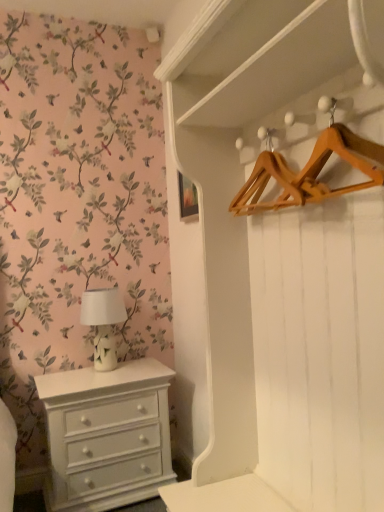
What do you see at coordinates (107, 435) in the screenshot?
I see `white painted wood chest of drawers at lower left` at bounding box center [107, 435].

Locate an element on the screen. This screenshot has height=512, width=384. white glossy table lamp at left is located at coordinates (103, 323).

At what (x,y) coordinates should I click in order to perform the action: click on white painted wood chest of drawers at lower left. Please return your answer as a coordinate pair (x, y). The height and width of the screenshot is (512, 384). Looking at the image, I should click on (x=107, y=435).

Identify the location of chest of drawers below the white glossy table lamp at left (from the image's perspective). The height and width of the screenshot is (512, 384). (107, 435).

Does white painted wood chest of drawers at lower left have a lesser height compared to white glossy table lamp at left?

No.

Between white painted wood chest of drawers at lower left and white glossy table lamp at left, which one appears on the left side from the viewer's perspective?

white glossy table lamp at left is more to the left.

How different are the orientations of white painted wood chest of drawers at lower left and white glossy table lamp at left in degrees?

They differ by 0.163 degrees in their facing directions.

Is white glossy table lamp at left next to white painted wood chest of drawers at lower left and touching it?

No, white glossy table lamp at left is not with white painted wood chest of drawers at lower left.

From a real-world perspective, is white glossy table lamp at left on white painted wood chest of drawers at lower left?

Yes, from a real-world perspective, white glossy table lamp at left is above white painted wood chest of drawers at lower left.

Based on the photo, between white glossy table lamp at left and white painted wood chest of drawers at lower left, which one has larger width?

white painted wood chest of drawers at lower left.

Looking at this image, who is smaller, white glossy table lamp at left or white painted wood chest of drawers at lower left?

white glossy table lamp at left.

In the scene shown: Are white glossy table lamp at left and wooden hanger at upper right beside each other?

No, white glossy table lamp at left is not beside wooden hanger at upper right.

Can you confirm if white glossy table lamp at left is shorter than wooden hanger at upper right?

No, white glossy table lamp at left is not shorter than wooden hanger at upper right.

Considering the positions of point (104, 370) and point (332, 114), is point (104, 370) closer or farther from the camera than point (332, 114)?

Point (104, 370) is farther from the camera than point (332, 114).

From the image's perspective, between white glossy table lamp at left and wooden hanger at upper right, who is located below?

white glossy table lamp at left.

From the image's perspective, is wooden hanger at upper right positioned above or below white painted wood chest of drawers at lower left?

wooden hanger at upper right is above white painted wood chest of drawers at lower left.

Which object is thinner, wooden hanger at upper right or white painted wood chest of drawers at lower left?

wooden hanger at upper right.

Which of these two, wooden hanger at upper right or white painted wood chest of drawers at lower left, is bigger?

Bigger between the two is white painted wood chest of drawers at lower left.

Measure the distance between wooden hanger at upper right and white glossy table lamp at left.

They are 1.25 meters apart.

This screenshot has width=384, height=512. I want to click on hanger located in front of the white glossy table lamp at left, so click(x=310, y=170).

Is white glossy table lamp at left surrounded by wooden hanger at upper right?

That's incorrect, white glossy table lamp at left is not inside wooden hanger at upper right.

Considering the sizes of wooden hanger at upper right and white glossy table lamp at left in the image, is wooden hanger at upper right taller or shorter than white glossy table lamp at left?

In the image, wooden hanger at upper right appears to be shorter than white glossy table lamp at left.

Is point (153, 492) positioned before point (253, 192)?

No, (153, 492) is behind (253, 192).

Considering the sizes of white painted wood chest of drawers at lower left and wooden hanger at upper right in the image, is white painted wood chest of drawers at lower left taller or shorter than wooden hanger at upper right?

Considering their sizes, white painted wood chest of drawers at lower left has more height than wooden hanger at upper right.

Which of these two, white painted wood chest of drawers at lower left or wooden hanger at upper right, is thinner?

wooden hanger at upper right is thinner.

Considering the relative sizes of white painted wood chest of drawers at lower left and wooden hanger at upper right in the image provided, is white painted wood chest of drawers at lower left bigger than wooden hanger at upper right?

Yes, white painted wood chest of drawers at lower left is bigger than wooden hanger at upper right.

Find the location of a particular element. chest of drawers on the right of white glossy table lamp at left is located at coordinates (107, 435).

At what (x,y) coordinates should I click in order to perform the action: click on chest of drawers in front of the white glossy table lamp at left. Please return your answer as a coordinate pair (x, y). Image resolution: width=384 pixels, height=512 pixels. Looking at the image, I should click on (107, 435).

Based on their spatial positions, is white painted wood chest of drawers at lower left or white glossy table lamp at left closer to wooden hanger at upper right?

white glossy table lamp at left is positioned closer to the anchor wooden hanger at upper right.

When comparing their distances from white glossy table lamp at left, does white painted wood chest of drawers at lower left or wooden hanger at upper right seem closer?

The object closer to white glossy table lamp at left is white painted wood chest of drawers at lower left.

Looking at the image, which one is located closer to wooden hanger at upper right, white glossy table lamp at left or white painted wood chest of drawers at lower left?

white glossy table lamp at left.

Based on the photo, which object lies further to the anchor point white painted wood chest of drawers at lower left, wooden hanger at upper right or white glossy table lamp at left?

wooden hanger at upper right is further to white painted wood chest of drawers at lower left.

Looking at the image, which one is located closer to white glossy table lamp at left, wooden hanger at upper right or white painted wood chest of drawers at lower left?

white painted wood chest of drawers at lower left lies closer to white glossy table lamp at left than the other object.

Looking at the image, which one is located closer to white painted wood chest of drawers at lower left, white glossy table lamp at left or wooden hanger at upper right?

Among the two, white glossy table lamp at left is located nearer to white painted wood chest of drawers at lower left.

I want to click on chest of drawers between wooden hanger at upper right and white glossy table lamp at left from front to back, so click(x=107, y=435).